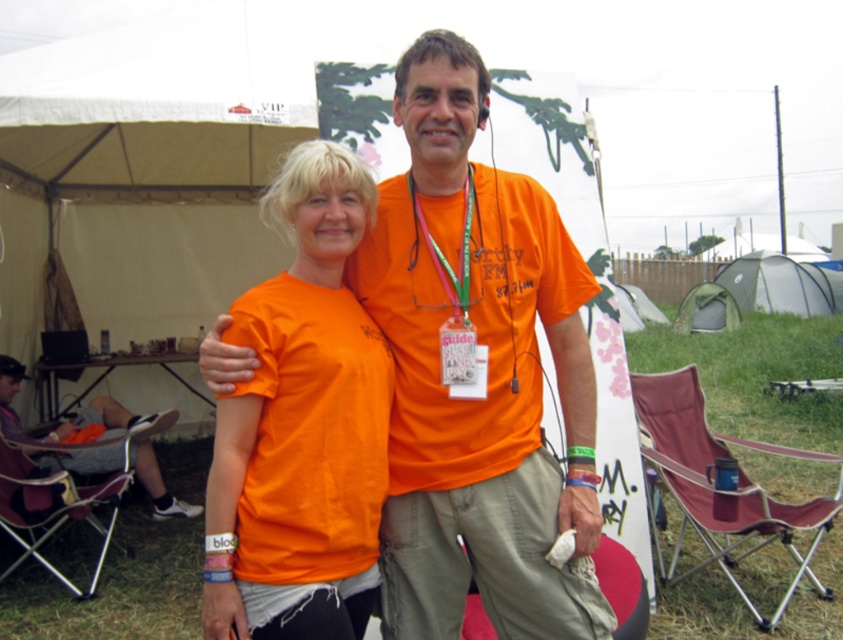
You are a photographer at the festival and need to capture a photo of both the orange cotton shirt at lower left and the orange fabric at center in the same frame. Considering their sizes, which object should you focus on to ensure both are visible without cropping?

The orange cotton shirt at lower left is bigger than the orange fabric at center, so you should focus on the orange cotton shirt at lower left to ensure both are visible without cropping.